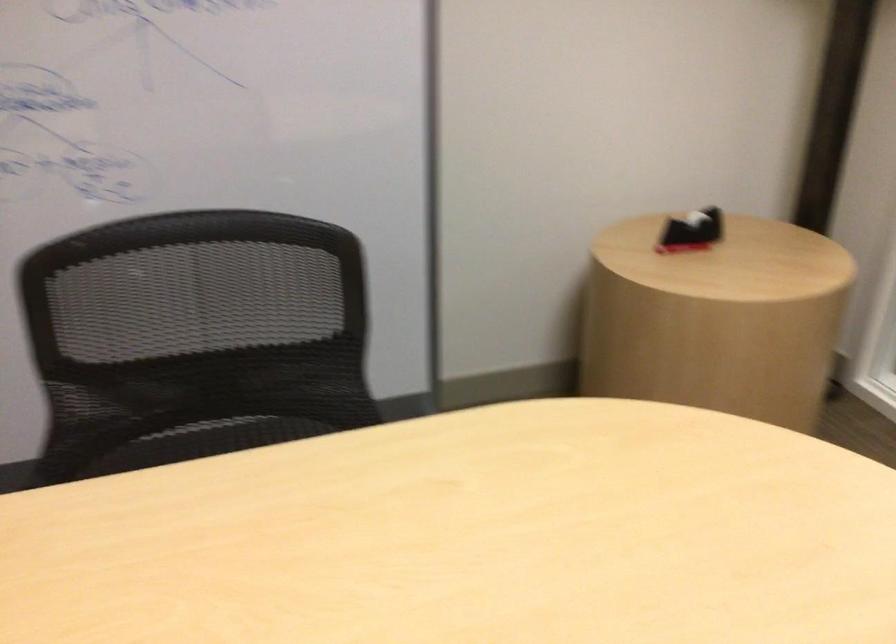
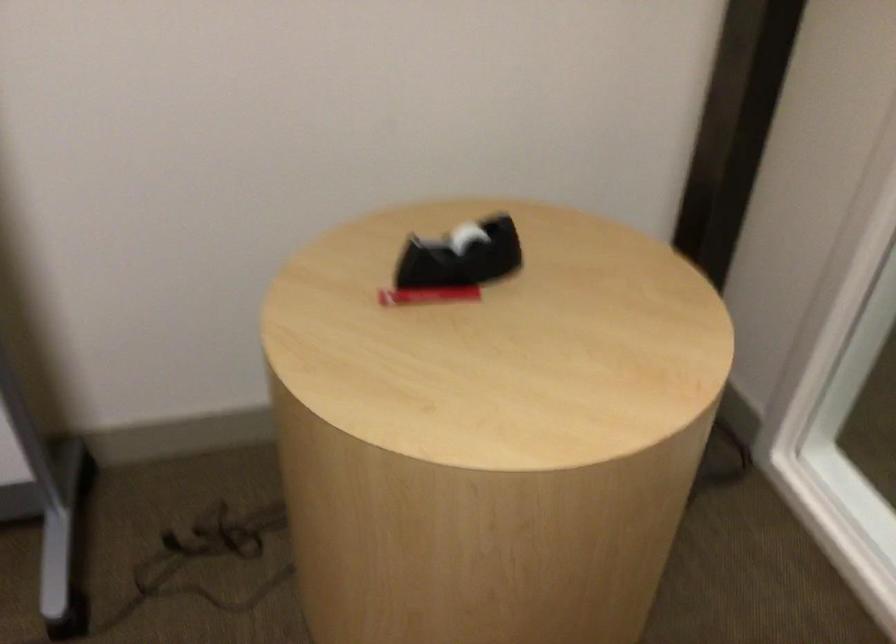
What movement of the cameraman would produce the second image?

The cameraman walked toward right, forward.